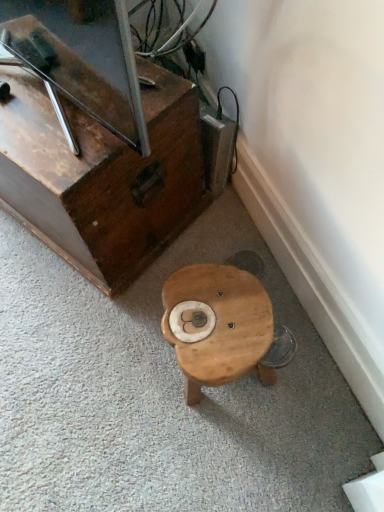
Find the location of `free spot above wooden stool at center (from a real-world perspective)`. free spot above wooden stool at center (from a real-world perspective) is located at coordinates (220, 320).